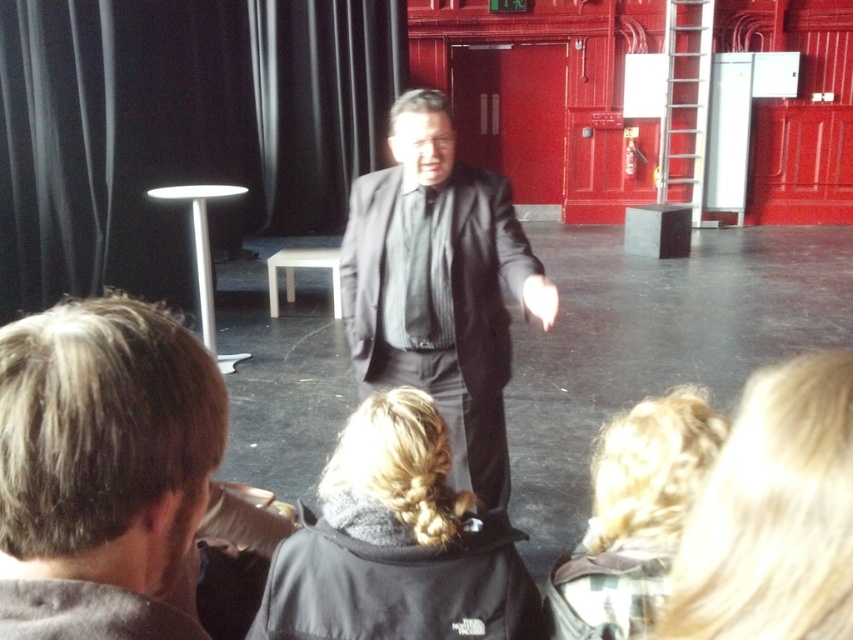
Question: Is matte black suit at center thinner than blonde hair at lower center?

Choices:
 (A) yes
 (B) no

Answer: (B)

Question: Does black fabric curtain at upper left come behind matte black suit at center?

Choices:
 (A) no
 (B) yes

Answer: (B)

Question: Which point is farther to the camera?

Choices:
 (A) gray hair at lower left
 (B) black fabric curtain at upper left
 (C) black fabric jacket at lower center
 (D) blonde hair at lower right

Answer: (B)

Question: Which point is farther to the camera?

Choices:
 (A) (468, 534)
 (B) (84, 136)
 (C) (155, 477)
 (D) (459, 285)

Answer: (B)

Question: Estimate the real-world distances between objects in this image. Which object is closer to the matte black suit at center?

Choices:
 (A) blonde hair at lower center
 (B) black fabric curtain at upper left

Answer: (A)

Question: Can you confirm if gray hair at lower left is wider than matte black suit at center?

Choices:
 (A) no
 (B) yes

Answer: (A)